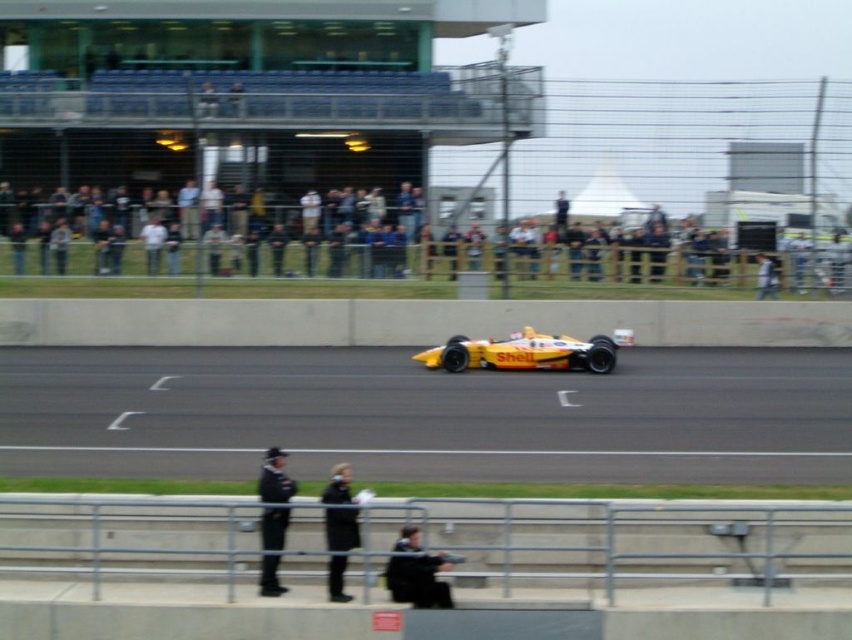
You are a drone operator trying to capture a closeup of the yellow race car at center. The drone is currently at point with coordinates [355,248]. Is the drone currently positioned over the yellow race car at center?

Yes, the point with coordinates [355,248] is on the yellow race car at center, so the drone is positioned over the yellow race car at center.

You are a spectator standing at the edge of the race track. You see the yellow rubber race track at center and the black leather jacket at center. Which object is closer to you?

→ The yellow rubber race track at center is closer to you because it is further to the viewer than the black leather jacket at center.